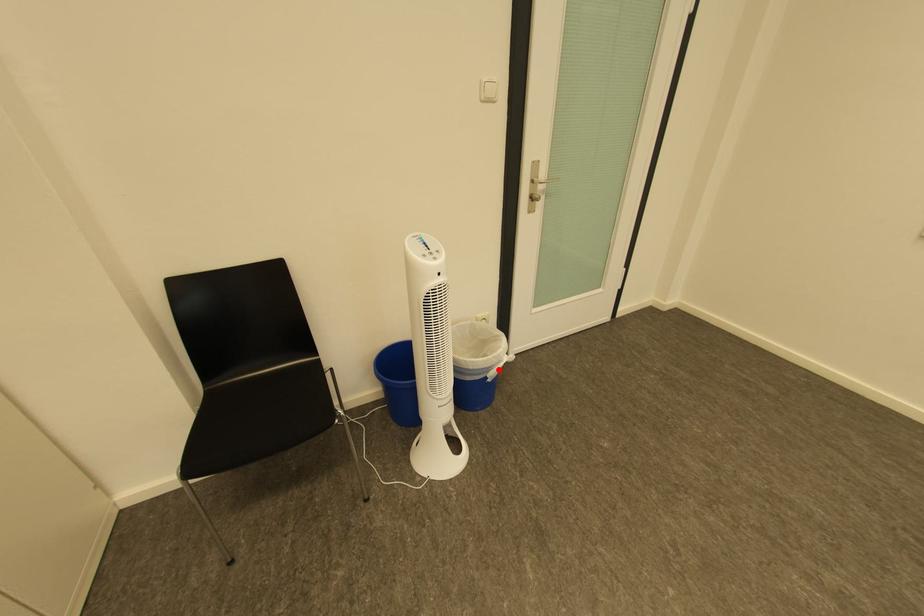
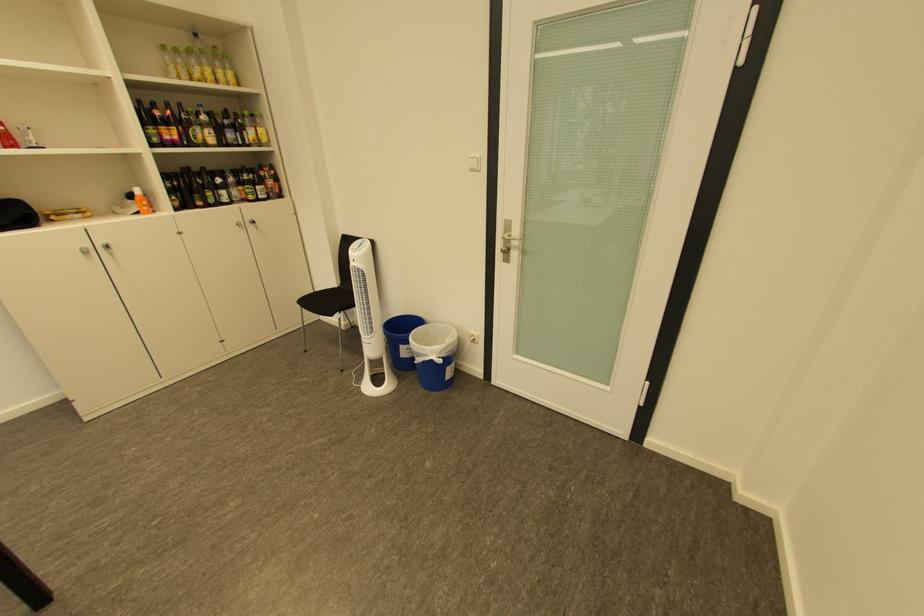
Find the pixel in the second image that matches the highlighted location in the first image.

(429, 355)